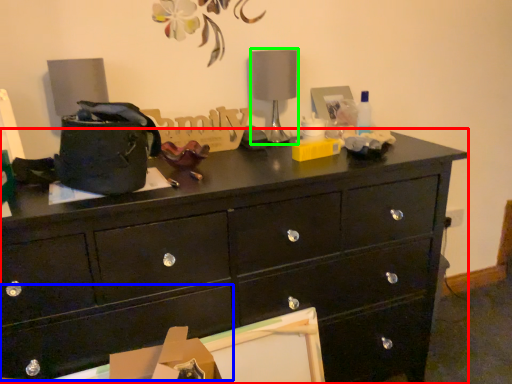
Question: Considering the real-world distances, which object is farthest from chest of drawers (highlighted by a red box)? drawer (highlighted by a blue box) or table lamp (highlighted by a green box)?

Choices:
 (A) drawer
 (B) table lamp

Answer: (B)